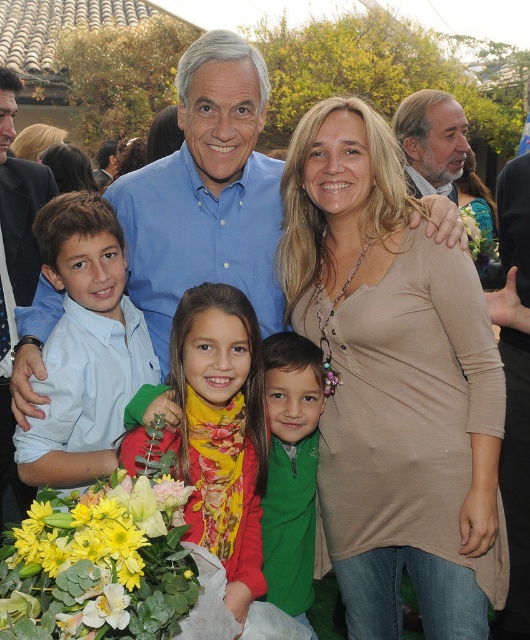
Question: Which point is farther to the camera?

Choices:
 (A) [485, 532]
 (B) [225, 349]

Answer: (A)

Question: Among these objects, which one is farthest from the camera?

Choices:
 (A) light blue shirt at center
 (B) beige fabric dress at center
 (C) yellow floral scarf at center
 (D) green fleece jacket at center

Answer: (D)

Question: Where is yellow matte flowers at lower left located in relation to gray hair man at upper right in the image?

Choices:
 (A) below
 (B) above

Answer: (A)

Question: Is beige fabric dress at center wider than gray hair man at upper right?

Choices:
 (A) yes
 (B) no

Answer: (A)

Question: Can you confirm if blue shirt at center is wider than gray hair man at upper right?

Choices:
 (A) no
 (B) yes

Answer: (A)

Question: Which point is closer to the camera?

Choices:
 (A) (80, 259)
 (B) (432, 170)

Answer: (A)